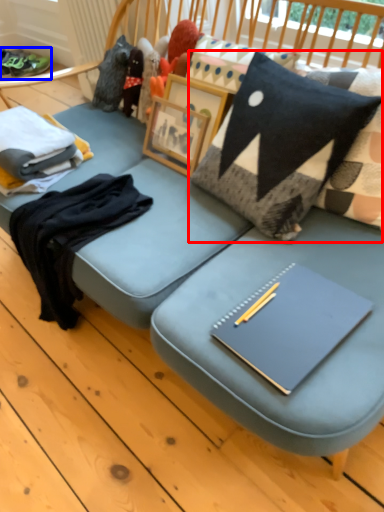
Question: Which point is closer to the camera, pillow (highlighted by a red box) or footwear (highlighted by a blue box)?

Choices:
 (A) pillow
 (B) footwear

Answer: (A)